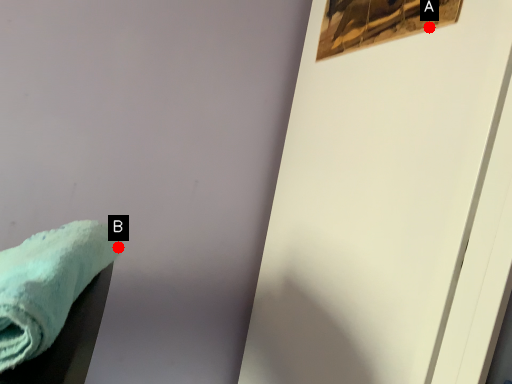
Question: Two points are circled on the image, labeled by A and B beside each circle. Which of the following is the farthest from the observer?

Choices:
 (A) A is further
 (B) B is further

Answer: (B)